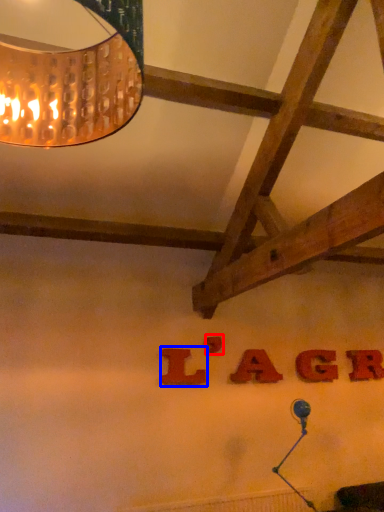
Question: Which object appears closest to the camera in this image, letter (highlighted by a red box) or letter (highlighted by a blue box)?

Choices:
 (A) letter
 (B) letter

Answer: (B)